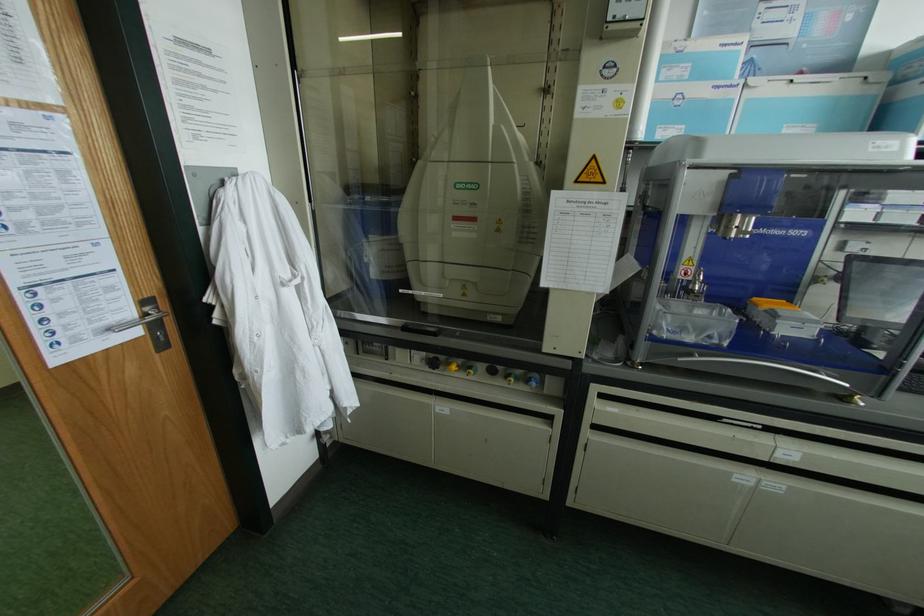
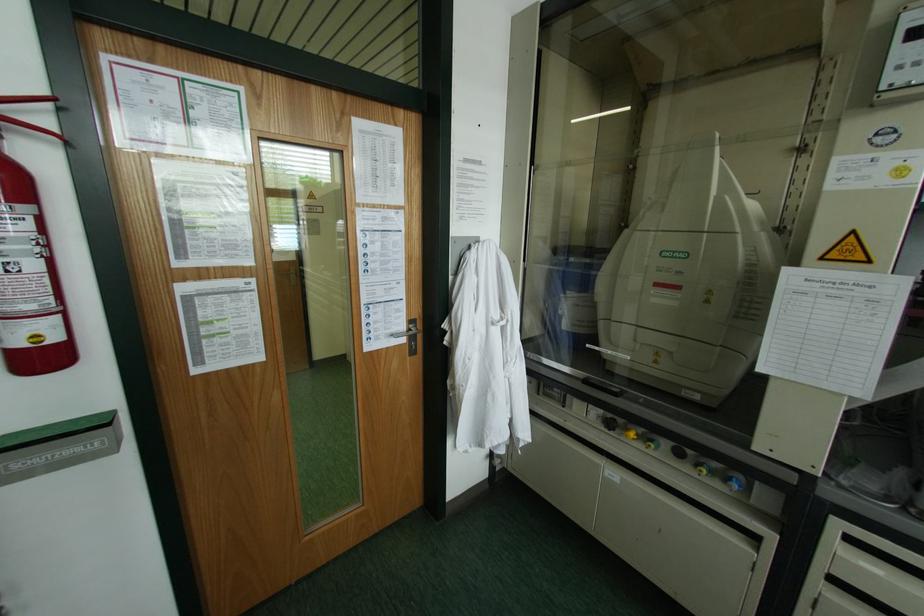
Find the pixel in the second image that matches the point at 454,367 in the first image.

(631, 434)